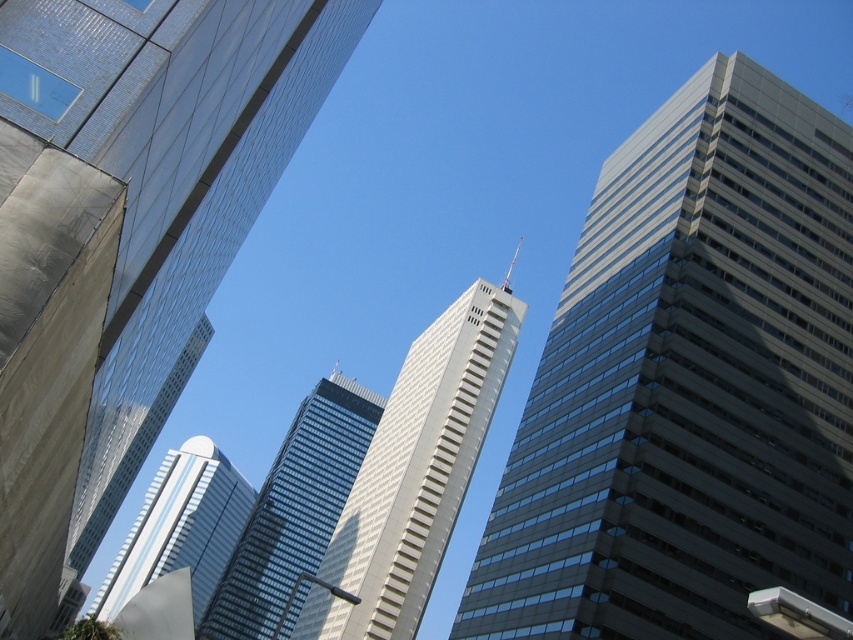
Can you confirm if gray glass skyscraper at upper right is positioned below glassy reflective skyscraper at center?

Actually, gray glass skyscraper at upper right is above glassy reflective skyscraper at center.

Is gray glass skyscraper at upper right to the right of glassy reflective skyscraper at center from the viewer's perspective?

Indeed, gray glass skyscraper at upper right is positioned on the right side of glassy reflective skyscraper at center.

Which is in front, point (480, 540) or point (306, 579)?

Point (306, 579) is more forward.

At what (x,y) coordinates should I click in order to perform the action: click on gray glass skyscraper at upper right. Please return your answer as a coordinate pair (x, y). The width and height of the screenshot is (853, 640). Looking at the image, I should click on (688, 385).

Is glassy steel skyscraper at upper center taller than gray glass skyscraper at center?

Incorrect, glassy steel skyscraper at upper center's height is not larger of gray glass skyscraper at center's.

Who is lower down, glassy steel skyscraper at upper center or gray glass skyscraper at center?

gray glass skyscraper at center is lower down.

Find the location of a particular element. This screenshot has width=853, height=640. glassy steel skyscraper at upper center is located at coordinates (126, 225).

Can you confirm if glassy steel skyscraper at upper center is positioned to the left of glassy reflective skyscraper at center?

In fact, glassy steel skyscraper at upper center is to the right of glassy reflective skyscraper at center.

Find the location of a particular element. glassy steel skyscraper at upper center is located at coordinates (126, 225).